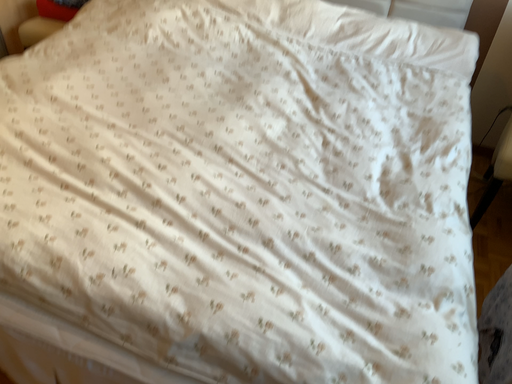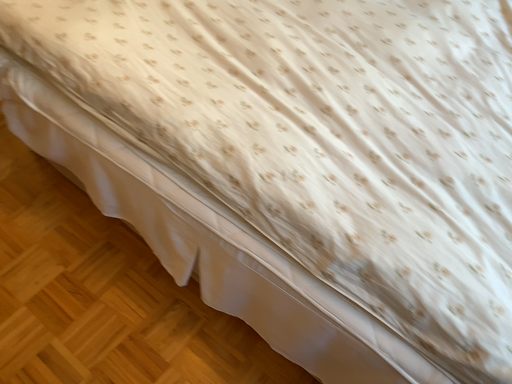
Question: Which way did the camera rotate in the video?

Choices:
 (A) rotated upward
 (B) rotated downward

Answer: (B)